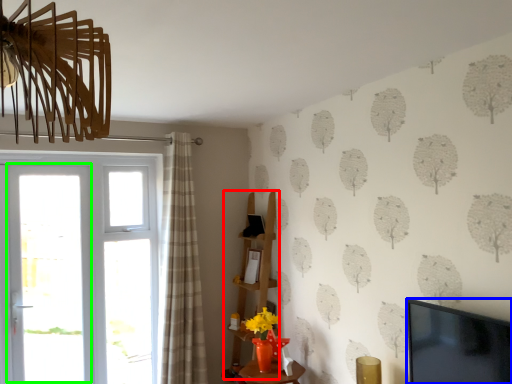
Question: Which object is the farthest from shelf (highlighted by a red box)? Choose among these: television (highlighted by a blue box) or screen door (highlighted by a green box).

Choices:
 (A) television
 (B) screen door

Answer: (A)